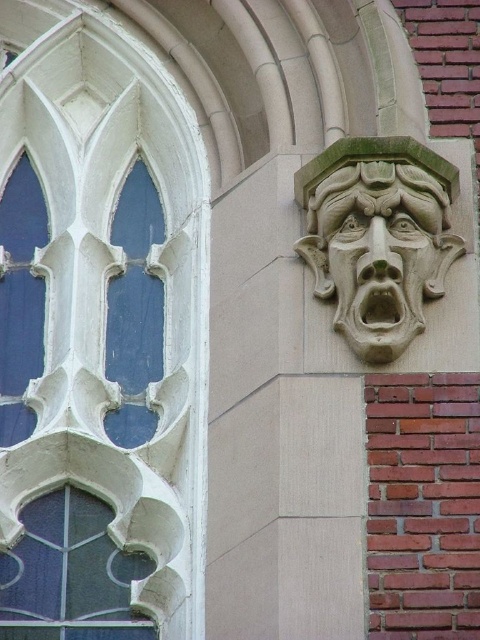
Question: Estimate the real-world distances between objects in this image. Which object is closer to the white stone window at upper left?

Choices:
 (A) dark blue glass at lower left
 (B) carved stone face at upper right
 (C) stone carved face at upper right

Answer: (B)

Question: Is white stone window at upper left positioned in front of dark blue glass at lower left?

Choices:
 (A) yes
 (B) no

Answer: (A)

Question: Is stone carved face at upper right to the left of carved stone face at upper right from the viewer's perspective?

Choices:
 (A) yes
 (B) no

Answer: (B)

Question: Which of the following is the farthest from the observer?

Choices:
 (A) (59, 497)
 (B) (118, 170)
 (C) (362, 177)

Answer: (B)

Question: Among these objects, which one is nearest to the camera?

Choices:
 (A) dark blue glass at lower left
 (B) stone carved face at upper right
 (C) white stone window at upper left
 (D) carved stone face at upper right

Answer: (C)

Question: Where is white stone window at upper left located in relation to carved stone face at upper right in the image?

Choices:
 (A) below
 (B) above

Answer: (A)